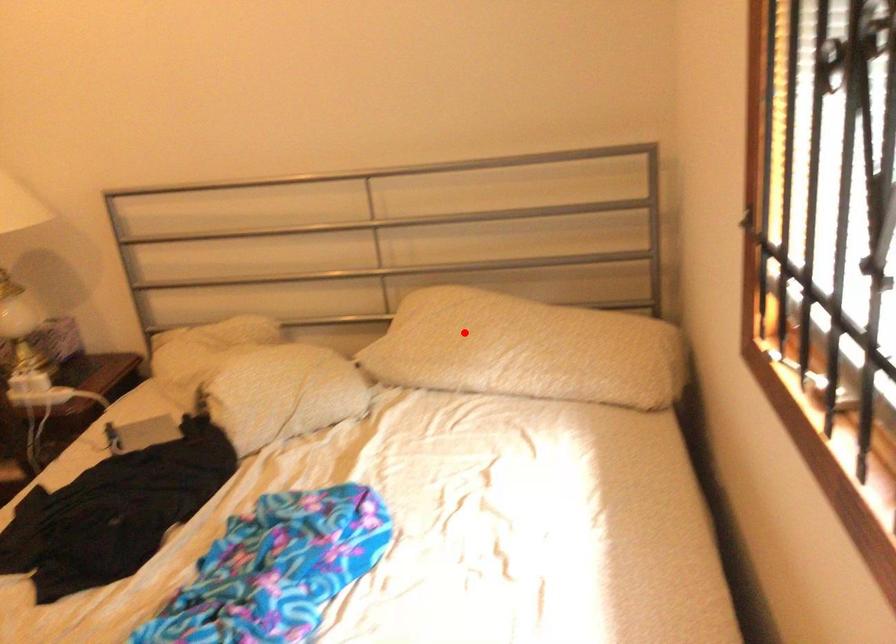
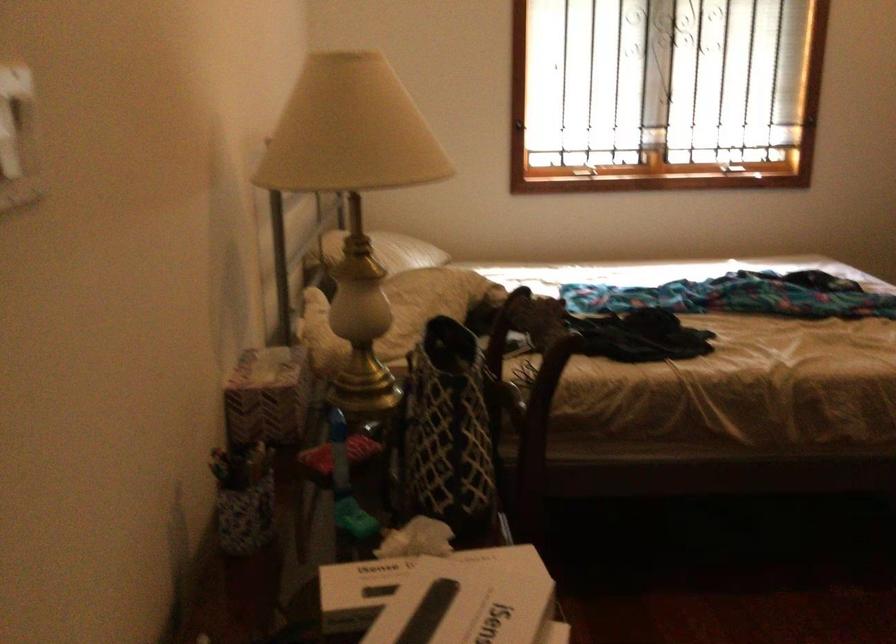
Question: I am providing you with two images of the same scene from different viewpoints. A red point is shown in image1. For the corresponding object point in image2, is it positioned nearer or farther from the camera?

Choices:
 (A) Nearer
 (B) Farther

Answer: (B)